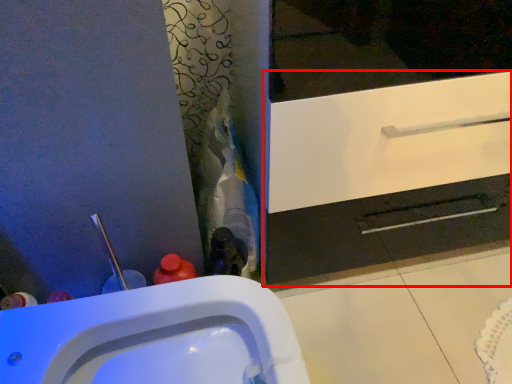
Question: Where is bathroom cabinet (annotated by the red box) located in relation to sink in the image?

Choices:
 (A) left
 (B) right

Answer: (B)